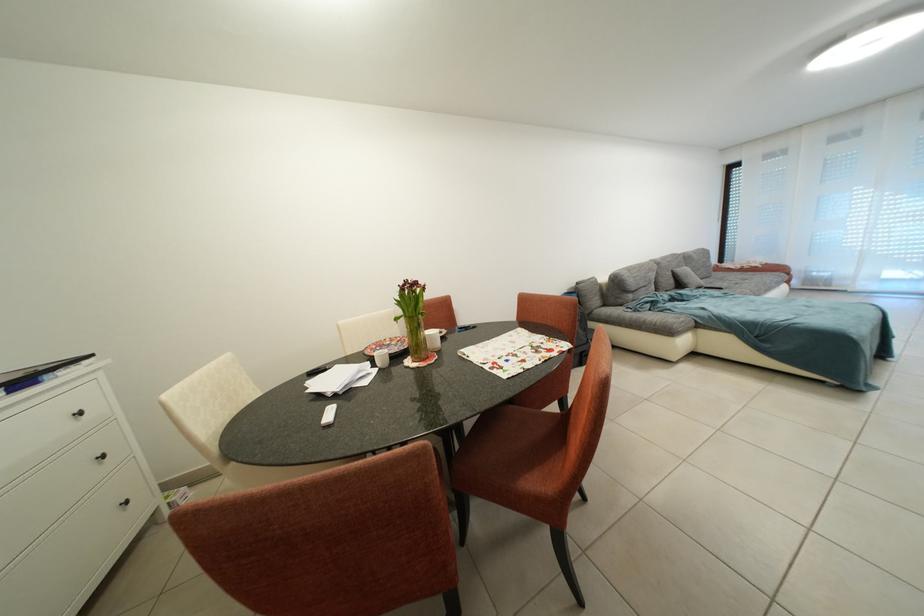
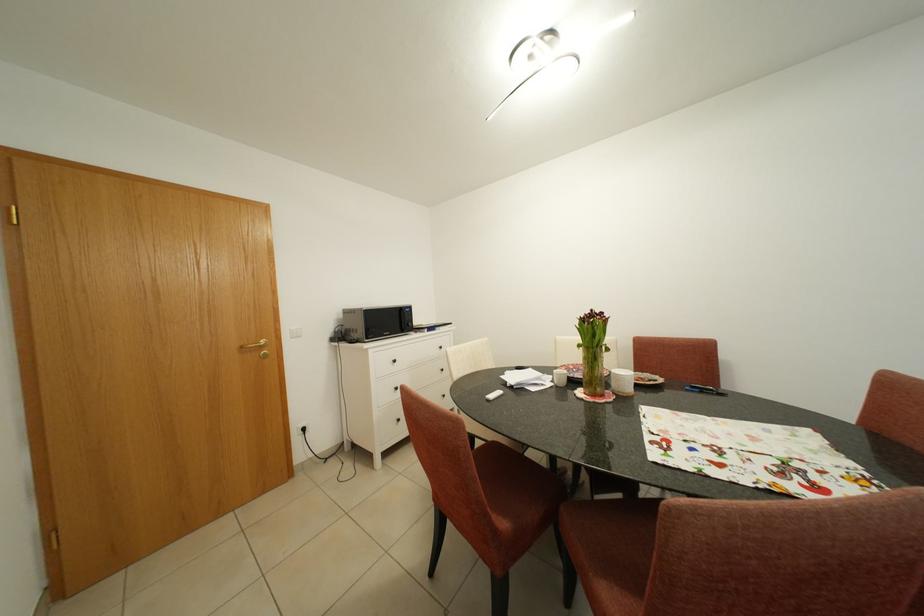
Where in the second image is the point corresponding to [382,370] from the first image?

(561, 385)